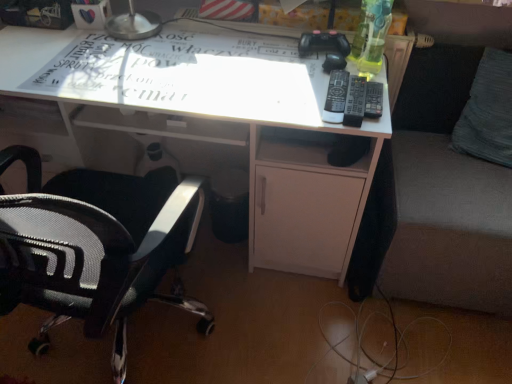
The image size is (512, 384). Identify the location of vacant space in white matte wire at lower center (from a real-world perspective). (376, 347).